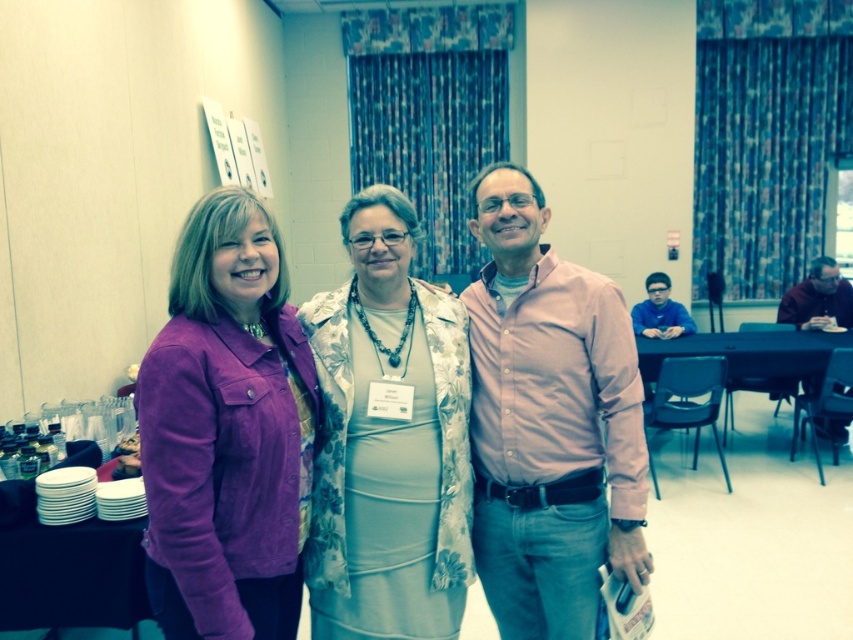
Is pink cotton shirt at center smaller than white plastic plates at lower left?

Actually, pink cotton shirt at center might be larger than white plastic plates at lower left.

Does point (482, 346) come behind point (65, 589)?

No, (482, 346) is in front of (65, 589).

Locate an element on the screen. This screenshot has height=640, width=853. pink cotton shirt at center is located at coordinates (549, 420).

Can you confirm if pink cotton shirt at center is positioned to the right of pink cotton shirt at right?

Incorrect, pink cotton shirt at center is not on the right side of pink cotton shirt at right.

Between point (483, 461) and point (804, 288), which one is positioned in front?

Positioned in front is point (483, 461).

Image resolution: width=853 pixels, height=640 pixels. I want to click on pink cotton shirt at center, so click(x=549, y=420).

Where is `pink cotton shirt at center`? This screenshot has height=640, width=853. pink cotton shirt at center is located at coordinates (549, 420).

Is pink cotton shirt at center to the right of black plastic table at lower right from the viewer's perspective?

Incorrect, pink cotton shirt at center is not on the right side of black plastic table at lower right.

Is point (489, 381) farther from viewer compared to point (715, 340)?

No, (489, 381) is closer to viewer.

Where is `pink cotton shirt at center`? The height and width of the screenshot is (640, 853). pink cotton shirt at center is located at coordinates (549, 420).